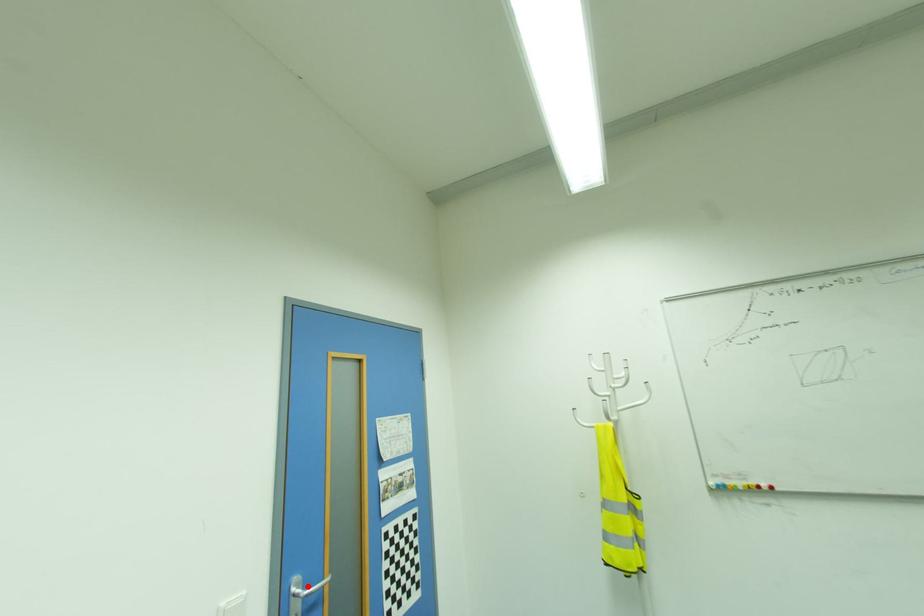
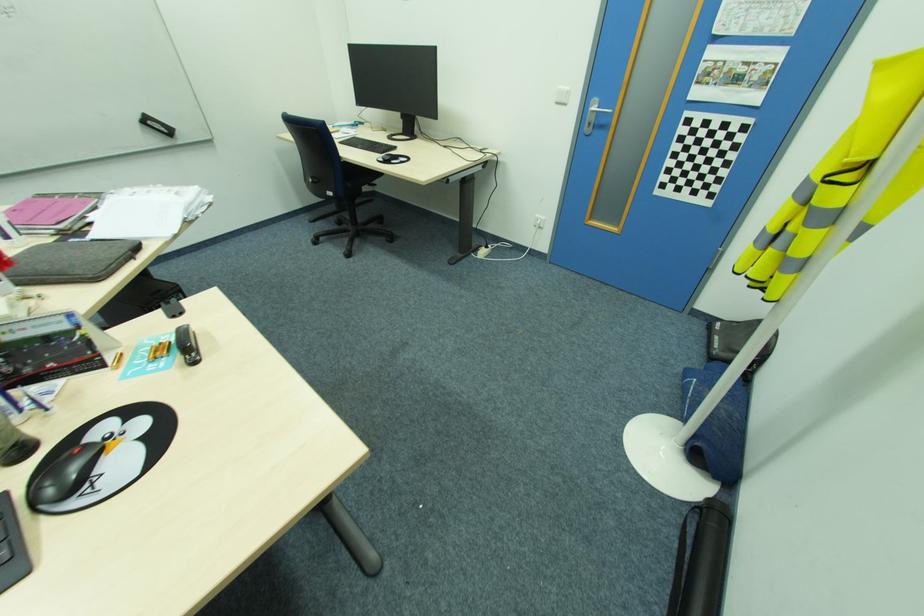
In the second image, find the point that corresponds to the highlighted location in the first image.

(600, 108)